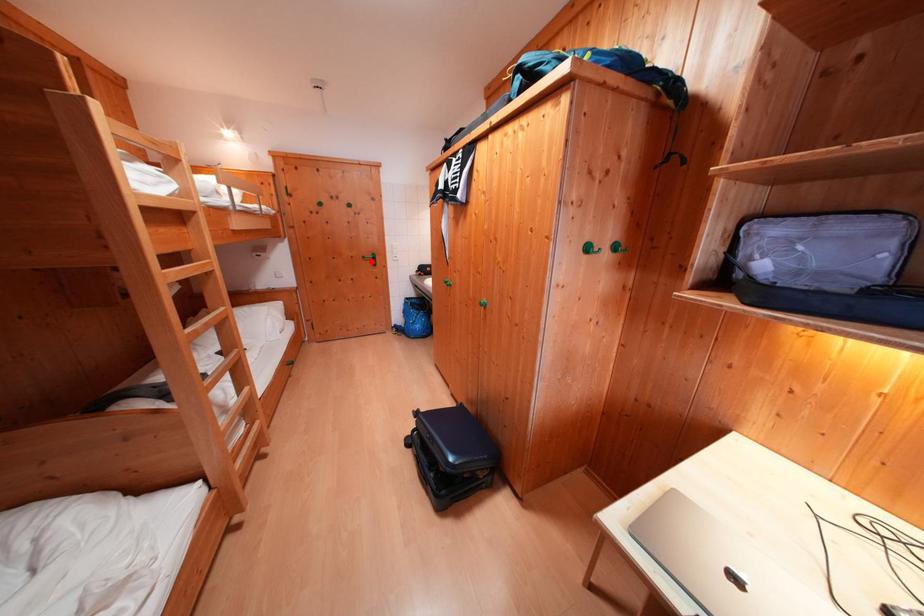
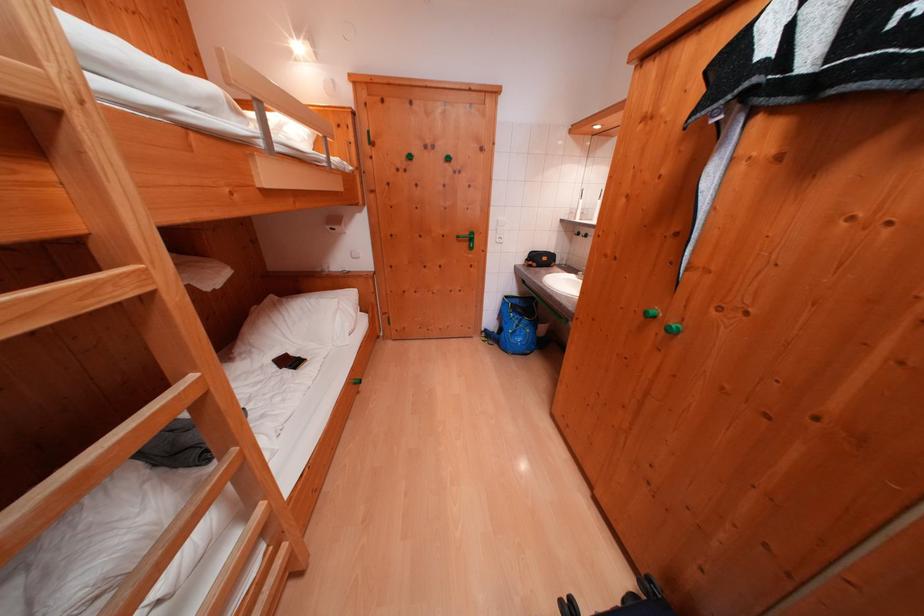
Question: I am providing you with two images of the same scene from different viewpoints. A red point is marked on the first image. Can you still see the location of the red point in image 2?

Choices:
 (A) Yes
 (B) No

Answer: (A)